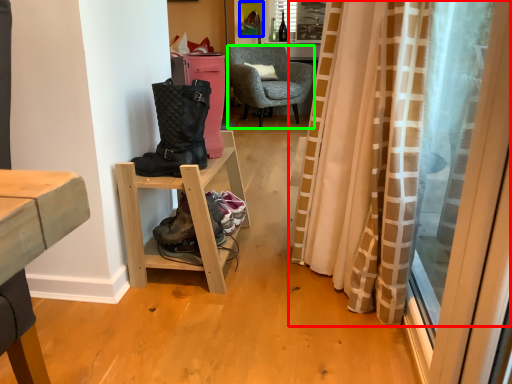
Question: Which is nearer to the curtain (highlighted by a red box)? picture frame (highlighted by a blue box) or chair (highlighted by a green box).

Choices:
 (A) picture frame
 (B) chair

Answer: (B)